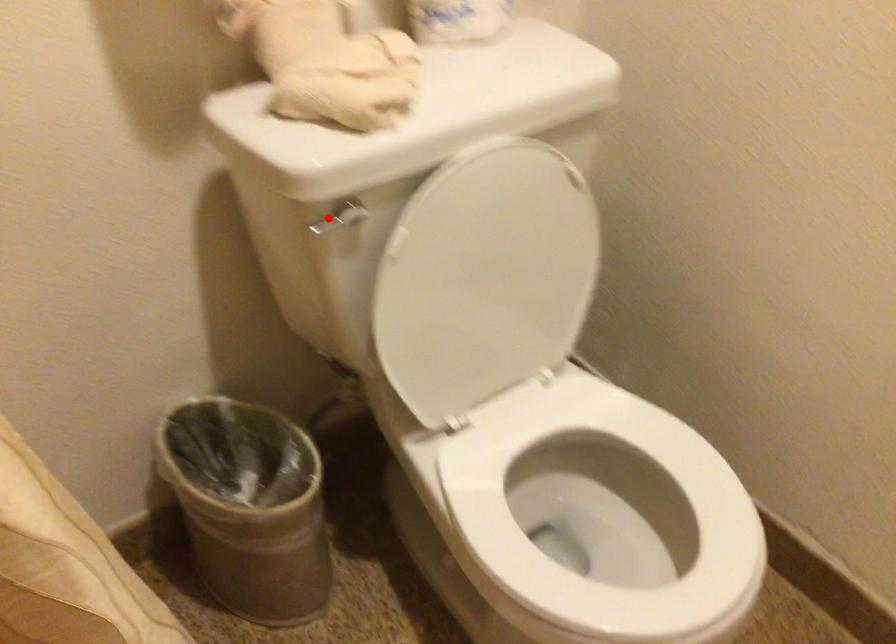
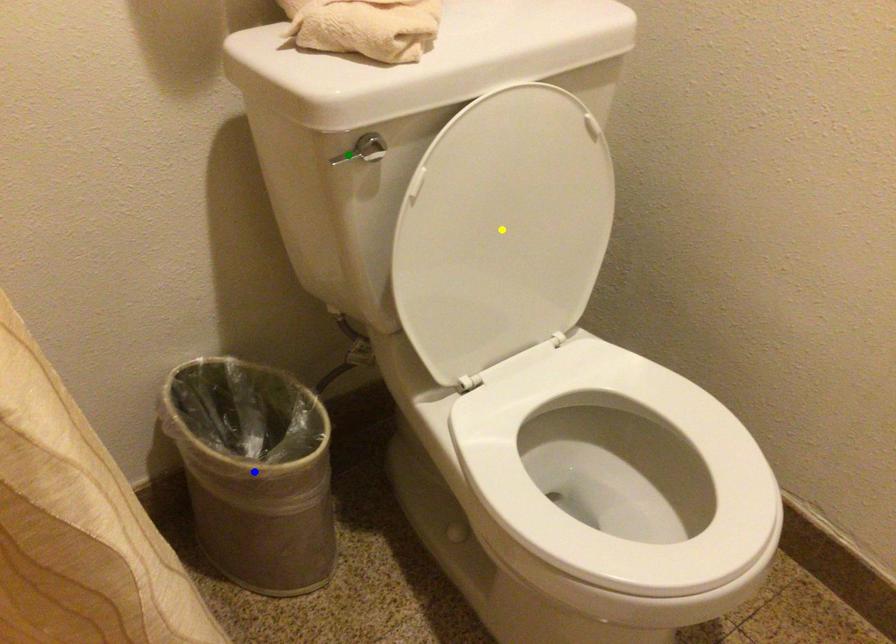
Question: I am providing you with two images of the same scene from different viewpoints. A red point is marked on the first image. You are given multiple points on the second image. Which spot in image 2 lines up with the point in image 1?

Choices:
 (A) yellow point
 (B) green point
 (C) blue point

Answer: (B)